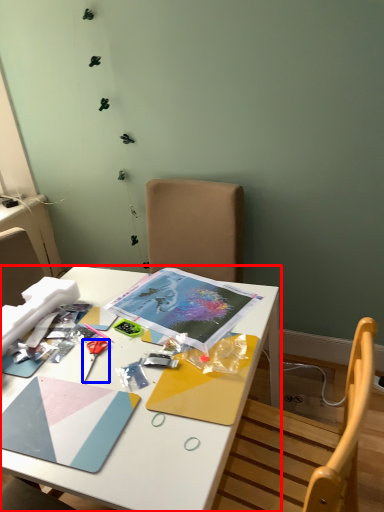
Question: Which object is closer to the camera taking this photo, desk (highlighted by a red box) or scissors (highlighted by a blue box)?

Choices:
 (A) desk
 (B) scissors

Answer: (A)